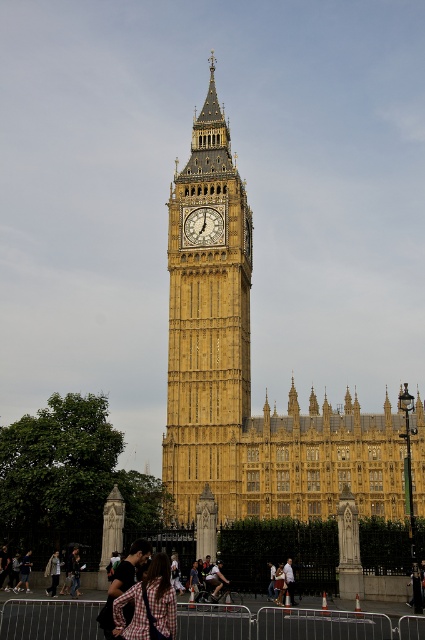
You are a tourist visiting London and want to take a photo of the gold textured clock at center and the light brown leather jacket at center. Which object should you focus on first if you want to ensure both are in the frame without moving the camera?

You should focus on the gold textured clock at center first because it is taller than the light brown leather jacket at center, so it will occupy more space in the frame and help you adjust the camera angle appropriately to include both objects.

You are standing in front of the Elizabeth Tower, commonly known as Big Ben, and you have a plaid fabric backpack at lower center. Where is your backpack located relative to the tower?

The plaid fabric backpack at lower center is located at the coordinates point (149, 604) relative to the tower.

You are a tourist visiting London and have a plaid fabric backpack at lower center and a light brown leather jacket at lower left. Which item do you need to adjust first if you want to ensure both items are of equal size?

The plaid fabric backpack at lower center is smaller than the light brown leather jacket at lower left, so you need to adjust the plaid fabric backpack at lower center first to make it larger to match the size of the light brown leather jacket at lower left.